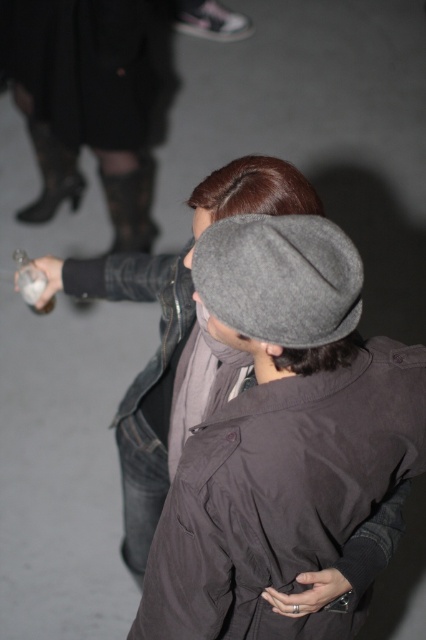
Can you confirm if gray woolen cap at center is thinner than translucent glass bottle at lower left?

No, gray woolen cap at center is not thinner than translucent glass bottle at lower left.

Does gray woolen cap at center have a greater height compared to translucent glass bottle at lower left?

Yes.

Is point (267, 198) positioned before point (26, 298)?

Yes, it is in front of point (26, 298).

This screenshot has height=640, width=426. Identify the location of gray woolen cap at center. (143, 380).

Does matte gray cap at center come in front of gray woolen cap at center?

Yes, it is.

From the picture: Which is more to the left, matte gray cap at center or gray woolen cap at center?

gray woolen cap at center

Is point (255, 321) closer to viewer compared to point (63, 264)?

Yes.

Locate an element on the screen. This screenshot has width=426, height=640. matte gray cap at center is located at coordinates (281, 435).

Is point (184, 566) positioned after point (32, 266)?

No, (184, 566) is in front of (32, 266).

The height and width of the screenshot is (640, 426). I want to click on matte gray cap at center, so click(281, 435).